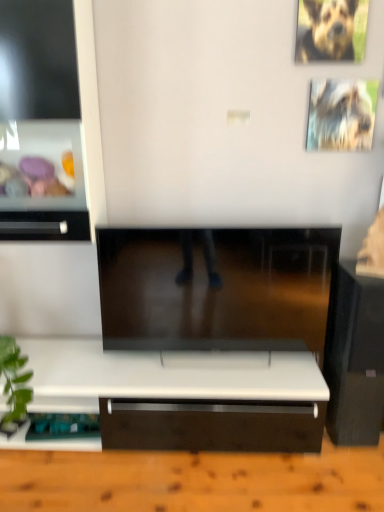
Question: Is point (319, 139) positioned closer to the camera than point (340, 35)?

Choices:
 (A) closer
 (B) farther

Answer: (B)

Question: From a real-world perspective, is metallic silver picture frame at upper right physically located above or below brown fur dog at upper right?

Choices:
 (A) below
 (B) above

Answer: (A)

Question: Estimate the real-world distances between objects in this image. Which object is closer to the metallic silver picture frame at upper right?

Choices:
 (A) black glossy speaker at right
 (B) white glossy drawer at left
 (C) brown fur dog at upper right

Answer: (C)

Question: Which of these objects is positioned farthest from the white glossy drawer at left?

Choices:
 (A) brown fur dog at upper right
 (B) metallic silver picture frame at upper right
 (C) black glossy speaker at right

Answer: (A)